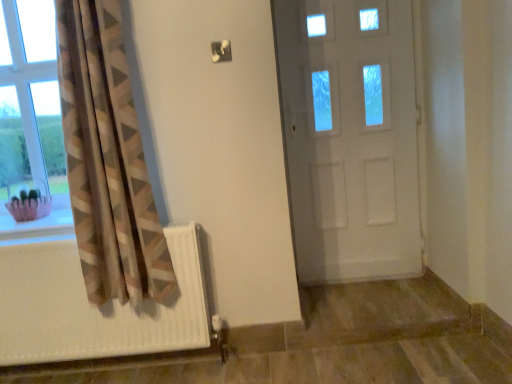
What are the coordinates of `white glossy door at center` in the screenshot? It's located at point(350,137).

Measure the distance between neutral fabric curtain at left and camera.

neutral fabric curtain at left is 5.61 feet away from camera.

The width and height of the screenshot is (512, 384). Describe the element at coordinates (31, 126) in the screenshot. I see `clear glass window at left` at that location.

Describe the element at coordinates (94, 306) in the screenshot. I see `white matte radiator at lower left` at that location.

Identify the location of white glossy door at center. The width and height of the screenshot is (512, 384). (350, 137).

Between pink fabric basket at lower left and white matte radiator at lower left, which one appears on the left side from the viewer's perspective?

pink fabric basket at lower left is more to the left.

Relative to white matte radiator at lower left, is pink fabric basket at lower left in front or behind?

pink fabric basket at lower left is behind white matte radiator at lower left.

The width and height of the screenshot is (512, 384). Find the location of `radiator on the right of pink fabric basket at lower left`. radiator on the right of pink fabric basket at lower left is located at coordinates (94, 306).

Is pink fabric basket at lower left far from white matte radiator at lower left?

No, pink fabric basket at lower left is not far from white matte radiator at lower left.

In terms of width, does clear glass window at left look wider or thinner when compared to pink fabric basket at lower left?

Considering their sizes, clear glass window at left looks slimmer than pink fabric basket at lower left.

Is point (45, 16) closer to viewer compared to point (48, 216)?

No, it is not.

Is clear glass window at left not near pink fabric basket at lower left?

clear glass window at left is near pink fabric basket at lower left, not far away.

Based on the photo, can you see neutral fabric curtain at left touching white matte radiator at lower left?

No, neutral fabric curtain at left is not next to white matte radiator at lower left.

From the image's perspective, is neutral fabric curtain at left positioned above or below white matte radiator at lower left?

Clearly, from the image's perspective, neutral fabric curtain at left is above white matte radiator at lower left.

Which object is closer to the camera, neutral fabric curtain at left or white matte radiator at lower left?

neutral fabric curtain at left is closer to the camera.

Considering the relative positions of neutral fabric curtain at left and white matte radiator at lower left in the image provided, is neutral fabric curtain at left to the right of white matte radiator at lower left from the viewer's perspective?

Indeed, neutral fabric curtain at left is positioned on the right side of white matte radiator at lower left.

Can you confirm if pink fabric basket at lower left is thinner than white glossy door at center?

No, pink fabric basket at lower left is not thinner than white glossy door at center.

The height and width of the screenshot is (384, 512). I want to click on door behind the pink fabric basket at lower left, so click(350, 137).

Is the depth of pink fabric basket at lower left greater than that of white glossy door at center?

No, it is not.

Is there a large distance between pink fabric basket at lower left and white glossy door at center?

That's right, there is a large distance between pink fabric basket at lower left and white glossy door at center.

Where is `window sill behind the white matte radiator at lower left`? window sill behind the white matte radiator at lower left is located at coordinates (39, 219).

Looking at this image, is white matte radiator at lower left aimed at pink fabric basket at lower left?

No, white matte radiator at lower left does not turn towards pink fabric basket at lower left.

Does white matte radiator at lower left have a greater height compared to pink fabric basket at lower left?

Correct, white matte radiator at lower left is much taller as pink fabric basket at lower left.

Is white matte radiator at lower left further to camera compared to pink fabric basket at lower left?

No, white matte radiator at lower left is closer to the camera.

From a real-world perspective, between clear glass window at left and neutral fabric curtain at left, who is vertically lower?

neutral fabric curtain at left is physically lower.

From their relative heights in the image, would you say clear glass window at left is taller or shorter than neutral fabric curtain at left?

Considering their sizes, clear glass window at left has less height than neutral fabric curtain at left.

Considering the relative positions of clear glass window at left and neutral fabric curtain at left in the image provided, is clear glass window at left in front of neutral fabric curtain at left?

No, clear glass window at left is further to the viewer.

Are clear glass window at left and neutral fabric curtain at left far apart?

clear glass window at left is actually quite close to neutral fabric curtain at left.

Between neutral fabric curtain at left and white glossy door at center, which one has larger size?

With larger size is neutral fabric curtain at left.

Does neutral fabric curtain at left have a greater width compared to white glossy door at center?

Correct, the width of neutral fabric curtain at left exceeds that of white glossy door at center.

Looking at this image, considering the positions of objects neutral fabric curtain at left and white glossy door at center in the image provided, who is more to the left, neutral fabric curtain at left or white glossy door at center?

Positioned to the left is neutral fabric curtain at left.

This screenshot has height=384, width=512. I want to click on radiator below the pink fabric basket at lower left (from the image's perspective), so click(x=94, y=306).

Find the location of `window behind the pink fabric basket at lower left`. window behind the pink fabric basket at lower left is located at coordinates (31, 126).

Looking at the image, which one is located further to white glossy door at center, white matte radiator at lower left or neutral fabric curtain at left?

The object further to white glossy door at center is white matte radiator at lower left.

From the picture: Looking at the image, which one is located closer to white glossy door at center, neutral fabric curtain at left or pink fabric basket at lower left?

neutral fabric curtain at left is closer to white glossy door at center.

Estimate the real-world distances between objects in this image. Which object is closer to white glossy door at center, pink fabric basket at lower left or white matte radiator at lower left?

The object closer to white glossy door at center is white matte radiator at lower left.

When comparing their distances from pink fabric basket at lower left, does white glossy door at center or neutral fabric curtain at left seem closer?

The object closer to pink fabric basket at lower left is neutral fabric curtain at left.

Looking at the image, which one is located further to neutral fabric curtain at left, white glossy door at center or white matte radiator at lower left?

white glossy door at center is further to neutral fabric curtain at left.

Based on their spatial positions, is white glossy door at center or pink fabric basket at lower left closer to clear glass window at left?

pink fabric basket at lower left lies closer to clear glass window at left than the other object.

Looking at the image, which one is located further to white glossy door at center, clear glass window at left or neutral fabric curtain at left?

clear glass window at left is positioned further to the anchor white glossy door at center.

Based on their spatial positions, is neutral fabric curtain at left or white glossy door at center closer to clear glass window at left?

neutral fabric curtain at left is positioned closer to the anchor clear glass window at left.

The image size is (512, 384). I want to click on curtain situated between white matte radiator at lower left and white glossy door at center from left to right, so click(x=106, y=160).

This screenshot has width=512, height=384. Find the location of `window sill between clear glass window at left and white glossy door at center from left to right`. window sill between clear glass window at left and white glossy door at center from left to right is located at coordinates (39, 219).

Locate an element on the screen. radiator located between clear glass window at left and white glossy door at center in the left-right direction is located at coordinates (94, 306).

Image resolution: width=512 pixels, height=384 pixels. I want to click on radiator between pink fabric basket at lower left and white glossy door at center, so click(94, 306).